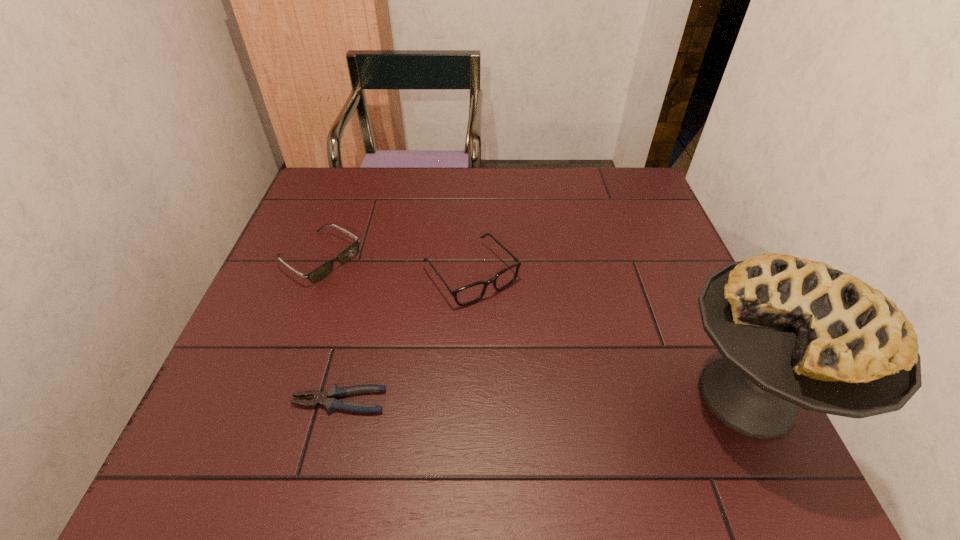
Identify the location of free space at the near right corner of the desktop. The height and width of the screenshot is (540, 960). (676, 409).

Locate an element on the screen. The height and width of the screenshot is (540, 960). free space between the sunglasses and the second tallest object is located at coordinates tap(395, 266).

Locate an element on the screen. The image size is (960, 540). free point between the spectacles and the rightmost object is located at coordinates (609, 335).

Image resolution: width=960 pixels, height=540 pixels. Find the location of `vacant point located between the tallest object and the sunglasses`. vacant point located between the tallest object and the sunglasses is located at coordinates (533, 328).

Locate an element on the screen. unoccupied position between the second object from right to left and the pliers is located at coordinates (405, 338).

The width and height of the screenshot is (960, 540). Identify the location of vacant space in between the sunglasses and the third shortest object. (395, 266).

Identify the location of free space between the pliers and the second shortest object. (329, 330).

Image resolution: width=960 pixels, height=540 pixels. I want to click on free area in between the shortest object and the pie, so click(x=543, y=399).

In order to click on vacant space in between the spectacles and the second shortest object in this screenshot , I will do `click(395, 266)`.

This screenshot has width=960, height=540. Identify the location of vacant area between the pliers and the spectacles. (405, 338).